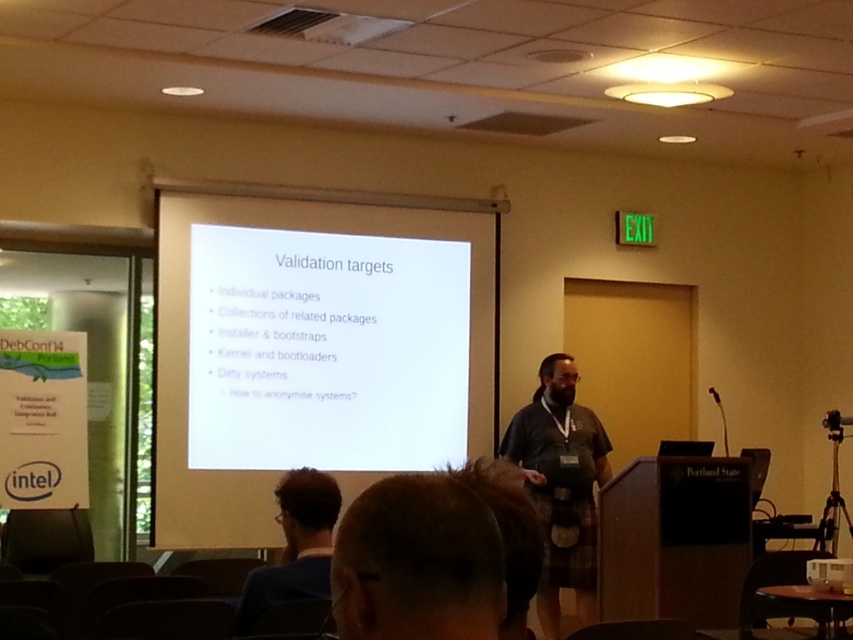
Question: Considering the relative positions of white matte projection screen at center and black fabric shirt at center in the image provided, where is white matte projection screen at center located with respect to black fabric shirt at center?

Choices:
 (A) right
 (B) left

Answer: (B)

Question: Which point appears closest to the camera in this image?

Choices:
 (A) (515, 428)
 (B) (310, 193)

Answer: (A)

Question: Is white matte projection screen at center bigger than black fabric shirt at center?

Choices:
 (A) no
 (B) yes

Answer: (B)

Question: Which point is closer to the camera?

Choices:
 (A) dark blue fabric at lower left
 (B) white matte projection screen at center

Answer: (A)

Question: Considering the real-world distances, which object is closest to the black fabric shirt at center?

Choices:
 (A) dark blue fabric at lower left
 (B) white matte projection screen at center

Answer: (B)

Question: Can you confirm if white matte projection screen at center is wider than dark blue fabric at lower left?

Choices:
 (A) yes
 (B) no

Answer: (A)